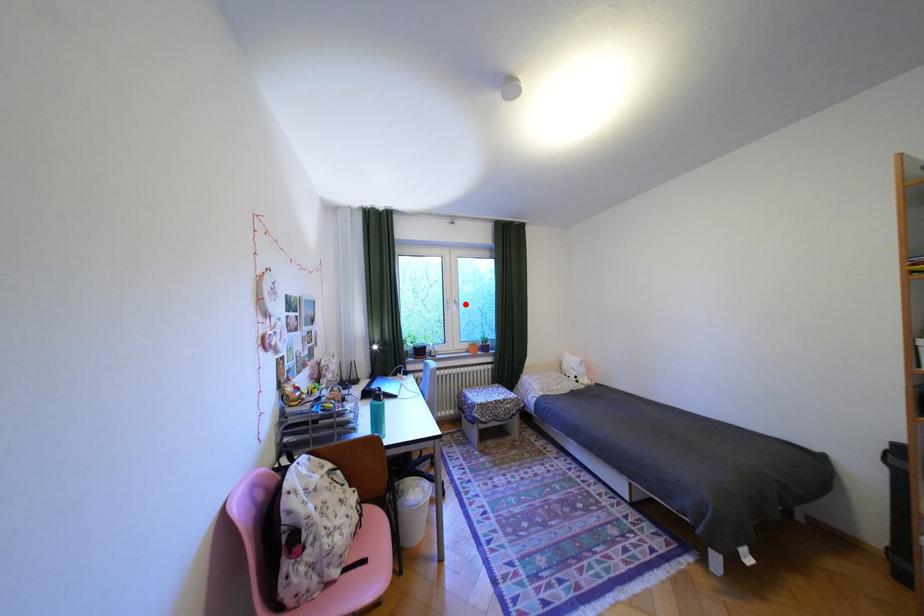
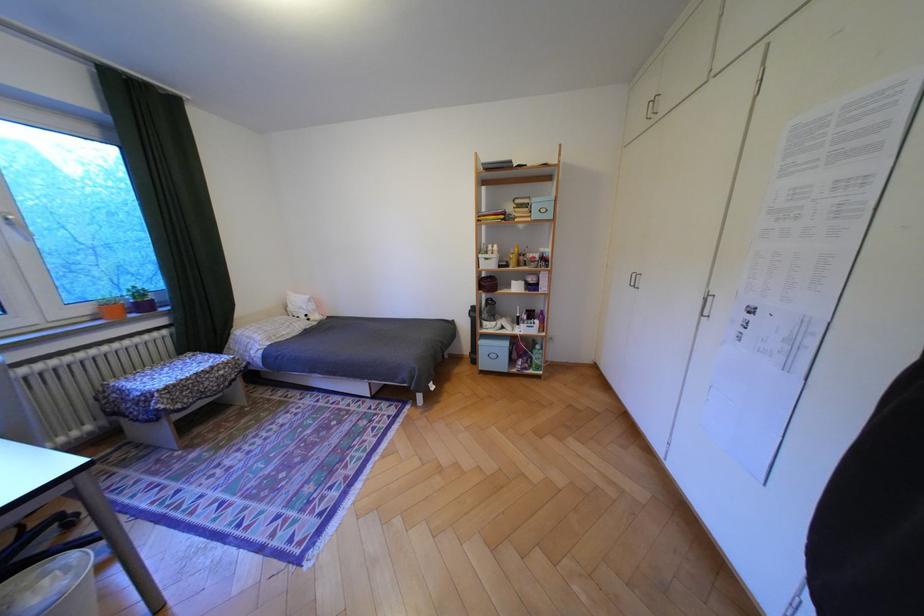
Question: I am providing you with two images of the same scene from different viewpoints. A red point is shown in image1. For the corresponding object point in image2, is it positioned nearer or farther from the camera?

Choices:
 (A) Nearer
 (B) Farther

Answer: (B)